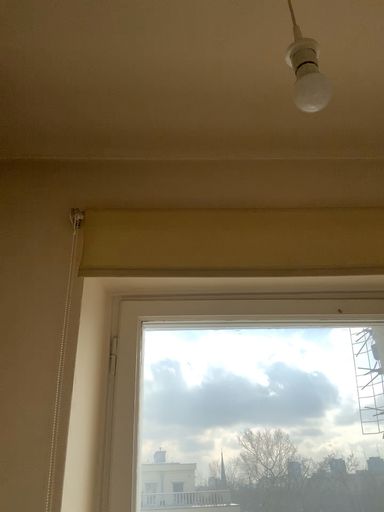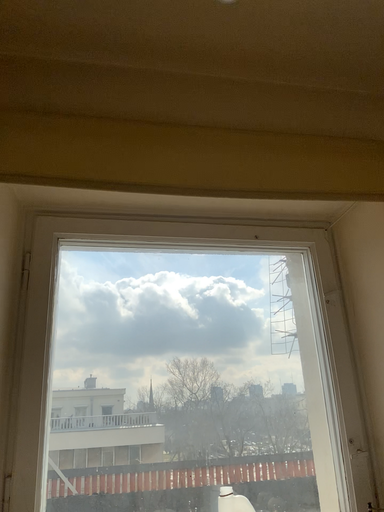
Question: Which way did the camera rotate in the video?

Choices:
 (A) rotated downward
 (B) rotated upward

Answer: (A)